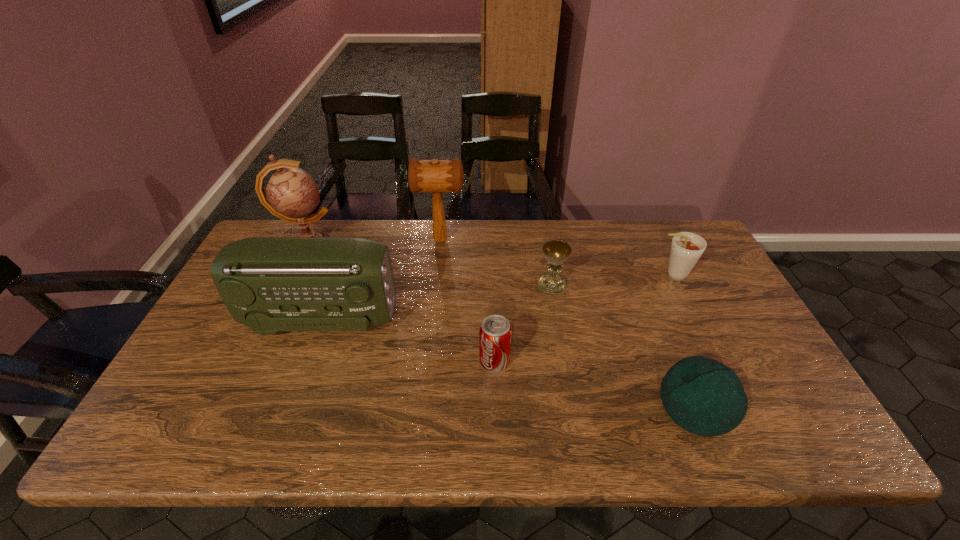
Where is `free space at the right edge of the desktop`? Image resolution: width=960 pixels, height=540 pixels. free space at the right edge of the desktop is located at coordinates (796, 399).

You are a GUI agent. You are given a task and a screenshot of the screen. Output one action in this format:
    pyautogui.click(x=<x>, y=<y>)
    Task: Click on the vacant area at the far left corner of the desktop
    The image size is (960, 540).
    Given the screenshot: What is the action you would take?
    pyautogui.click(x=280, y=225)

Where is `blank space at the far right corner`? blank space at the far right corner is located at coordinates (682, 226).

The width and height of the screenshot is (960, 540). Find the location of `free region at the near right corner of the desktop`. free region at the near right corner of the desktop is located at coordinates (787, 449).

This screenshot has height=540, width=960. I want to click on free space between the chalice and the radio_receiver, so click(x=437, y=302).

Where is `vacant area that lies between the fifth object from left to right and the soda can`? The width and height of the screenshot is (960, 540). vacant area that lies between the fifth object from left to right and the soda can is located at coordinates (523, 323).

Find the location of a particular element. unoccupied area between the nearest object and the third object from right to left is located at coordinates (624, 345).

Image resolution: width=960 pixels, height=540 pixels. I want to click on vacant area that lies between the third object from left to right and the third object from right to left, so click(x=496, y=263).

Where is `vacant space that is in between the globe and the fifth object from left to right`? vacant space that is in between the globe and the fifth object from left to right is located at coordinates (430, 266).

Where is `free space between the fifth object from left to right and the mallet`? free space between the fifth object from left to right and the mallet is located at coordinates [x=496, y=263].